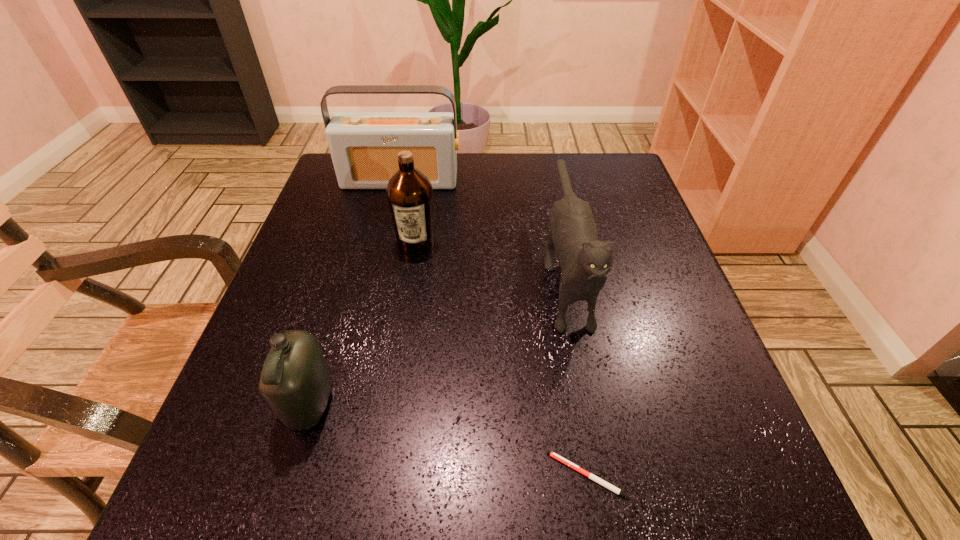
Identify the location of vacant space at the left edge of the desktop. (300, 260).

In the image, there is a desktop. Where is `free region at the right edge`? The height and width of the screenshot is (540, 960). free region at the right edge is located at coordinates (646, 429).

Locate an element on the screen. The height and width of the screenshot is (540, 960). blank space at the near left corner of the desktop is located at coordinates coord(278,472).

I want to click on vacant space at the near right corner of the desktop, so click(708, 488).

Where is `free point between the nearest object and the olive oil`? This screenshot has height=540, width=960. free point between the nearest object and the olive oil is located at coordinates (502, 359).

Where is `free space between the shortest object and the olive oil`? Image resolution: width=960 pixels, height=540 pixels. free space between the shortest object and the olive oil is located at coordinates (502, 359).

This screenshot has height=540, width=960. I want to click on vacant space that's between the cat and the shortest object, so [576, 373].

In order to click on vacant space that is in between the cat and the second shortest object in this screenshot , I will do `click(438, 338)`.

Image resolution: width=960 pixels, height=540 pixels. In order to click on empty space that is in between the farthest object and the nearest object in this screenshot , I will do `click(494, 328)`.

Find the location of `free space that is in between the olive oil and the cat`. free space that is in between the olive oil and the cat is located at coordinates (491, 257).